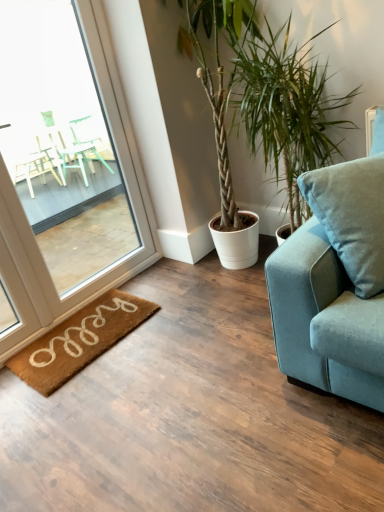
Question: In terms of size, does clear glass window at left appear bigger or smaller than green leafy plant at center?

Choices:
 (A) big
 (B) small

Answer: (B)

Question: Is point (86, 209) positioned closer to the camera than point (223, 206)?

Choices:
 (A) farther
 (B) closer

Answer: (A)

Question: Which object is positioned closest to the clear glass window at left?

Choices:
 (A) brown coir mat at lower left
 (B) green leafy plant at center
 (C) velvet blue couch at right

Answer: (A)

Question: Estimate the real-world distances between objects in this image. Which object is farther from the green leafy plant at center?

Choices:
 (A) clear glass window at left
 (B) velvet blue couch at right
 (C) brown coir mat at lower left

Answer: (C)